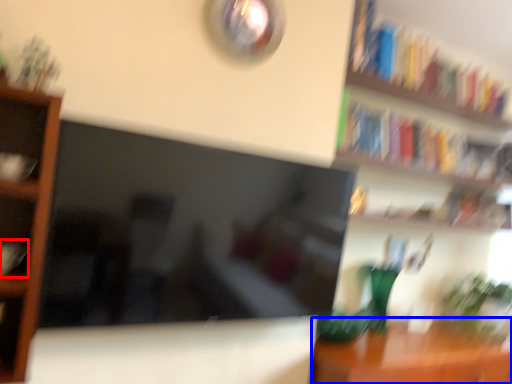
Question: Which object is closer to the camera taking this photo, book (highlighted by a red box) or table (highlighted by a blue box)?

Choices:
 (A) book
 (B) table

Answer: (A)